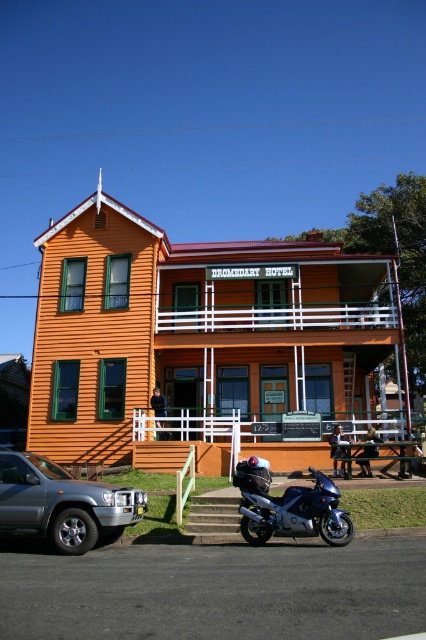
You are standing in front of the Dromedary Hotel and need to park your car, which is 15 feet long. The silver metallic suv at lower left is parked in the parking spot you want. Can you determine if your car will fit in the same parking spot?

The silver metallic suv at lower left is 28.26 feet away from viewer. Since your car is 15 feet long and the parking spot can accommodate the SUV, which is likely longer than or equal to your car, your car should fit in the same parking spot.

You are standing in front of the DROMEDARY HOTEL and need to park your car. You have a silver metallic suv at lower left and a blue metallic motorcycle at lower center. Which vehicle is closer to the entrance of the hotel?

The silver metallic suv at lower left is closer to the entrance of the hotel because it is positioned to the left of the blue metallic motorcycle at lower center, and the entrance is likely located near the lower left area where the suv is parked.

Looking at this image, you are a delivery driver who needs to park your vehicle in front of the DROMEDARY HOTEL. You have two options for parking spots available. One is next to the silver metallic suv at lower left and the other is next to the blue metallic motorcycle at lower center. Which parking spot will allow your vehicle to fit better?

The parking spot next to the silver metallic suv at lower left will allow your vehicle to fit better since the silver metallic suv at lower left is larger than the blue metallic motorcycle at lower center, indicating that the space there can accommodate bigger vehicles.